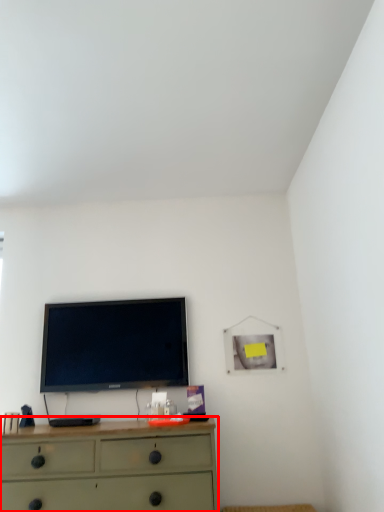
Question: Where is chest of drawers (annotated by the red box) located in relation to television in the image?

Choices:
 (A) left
 (B) right

Answer: (B)